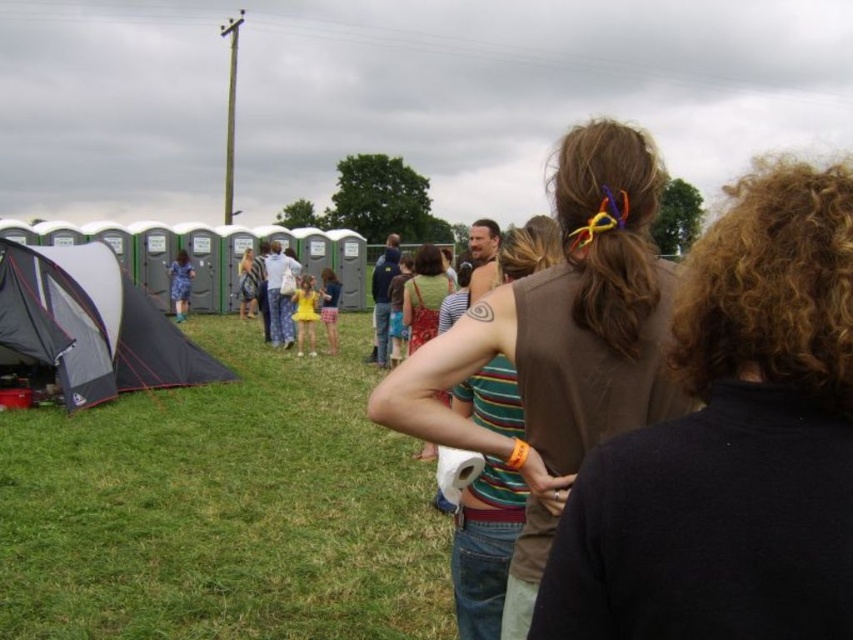
Question: Which point appears farthest from the camera in this image?

Choices:
 (A) (602, 424)
 (B) (35, 266)
 (C) (421, 323)
 (D) (378, 449)

Answer: (B)

Question: Can you confirm if brown hair at center is positioned below matte green dress at center?

Choices:
 (A) yes
 (B) no

Answer: (A)

Question: Which point is closer to the camera?

Choices:
 (A) (761, 344)
 (B) (129, 628)
 (C) (25, 355)
 (D) (415, 316)

Answer: (A)

Question: Can you confirm if brown hair at center is positioned to the right of brown fabric shirt at center?

Choices:
 (A) yes
 (B) no

Answer: (A)

Question: Which object is closer to the camera taking this photo?

Choices:
 (A) brown hair at center
 (B) green grass at lower left
 (C) brown fabric shirt at center

Answer: (A)

Question: Does brown fabric shirt at center appear on the right side of matte green dress at center?

Choices:
 (A) no
 (B) yes

Answer: (B)